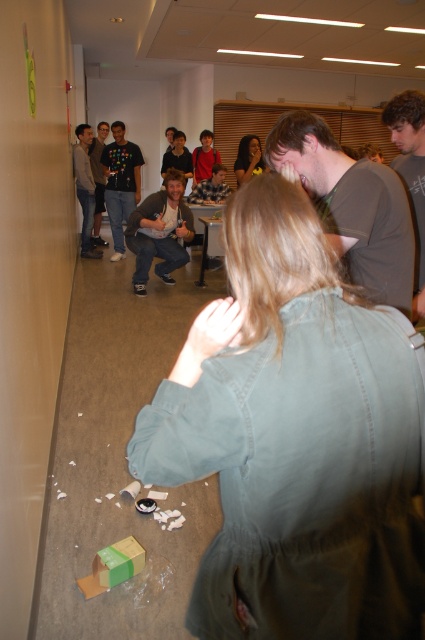
Looking at this image, you are standing in the hallway and want to move towards the point that is closer to you. Which point should you move towards, point (404, 291) or point (255, 168)?

You should move towards point (404, 291) because it is closer to the viewer than point (255, 168).

You are standing at the entrance of the hallway and notice a dark gray shirt at center and a matte black hair at center. If you want to approach both, which one should you move towards first to reach them in the shortest path?

Both the dark gray shirt at center and the matte black hair at center are 4.81 meters away from your current position, so you can choose either one to approach first as the distance is the same.